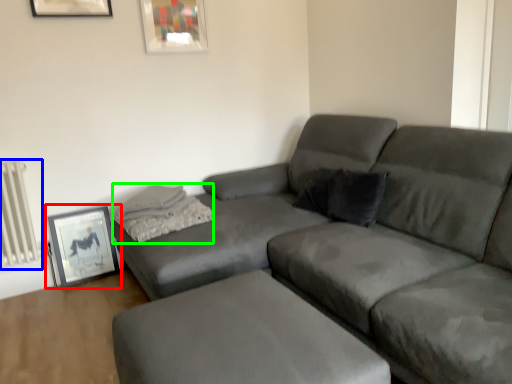
Question: Which object is the farthest from picture frame (highlighted by a red box)? Choose among these: radiator (highlighted by a blue box) or pillow (highlighted by a green box).

Choices:
 (A) radiator
 (B) pillow

Answer: (B)